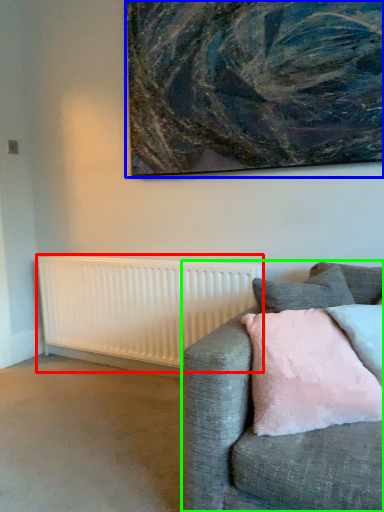
Question: Estimate the real-world distances between objects in this image. Which object is farther from radiator (highlighted by a red box), picture frame (highlighted by a blue box) or studio couch (highlighted by a green box)?

Choices:
 (A) picture frame
 (B) studio couch

Answer: (B)